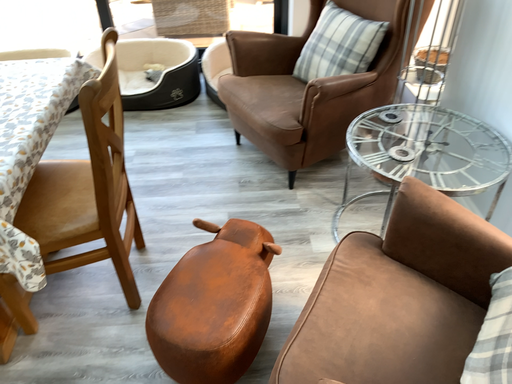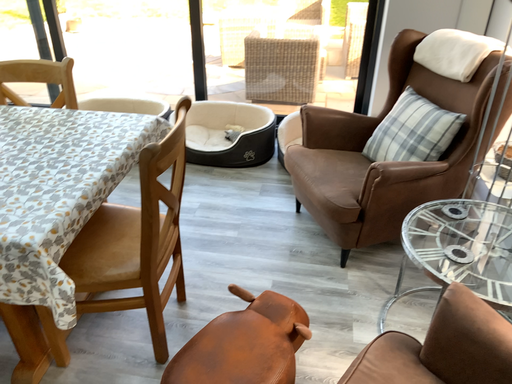
Question: Which way did the camera rotate in the video?

Choices:
 (A) rotated downward
 (B) rotated upward

Answer: (B)